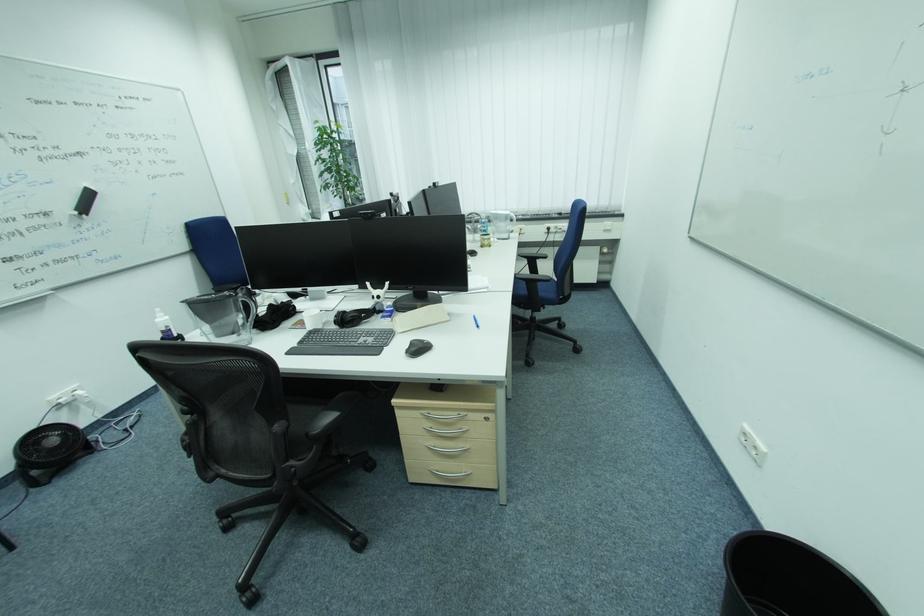
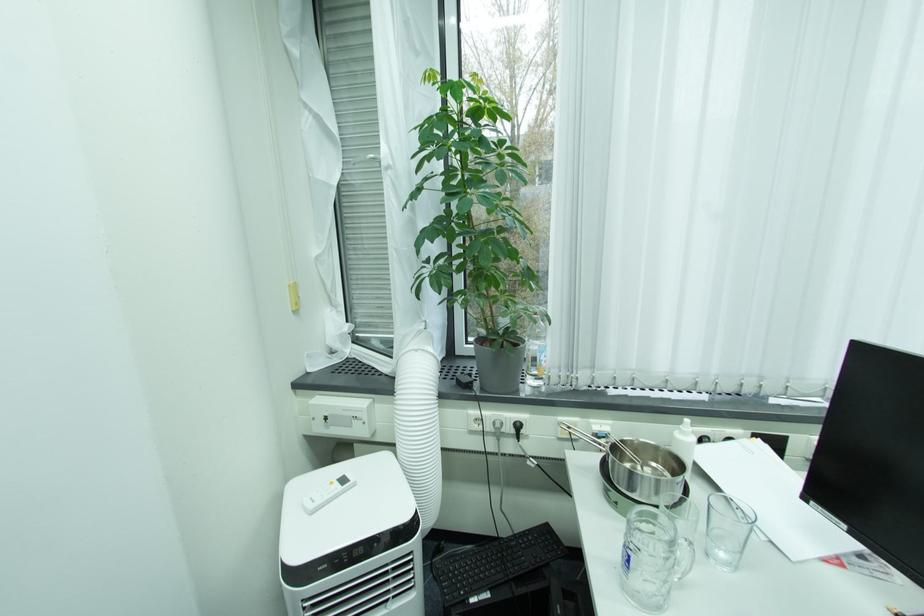
Which direction would the cameraman need to move to produce the second image?

The movement direction of the cameraman is left, forward.